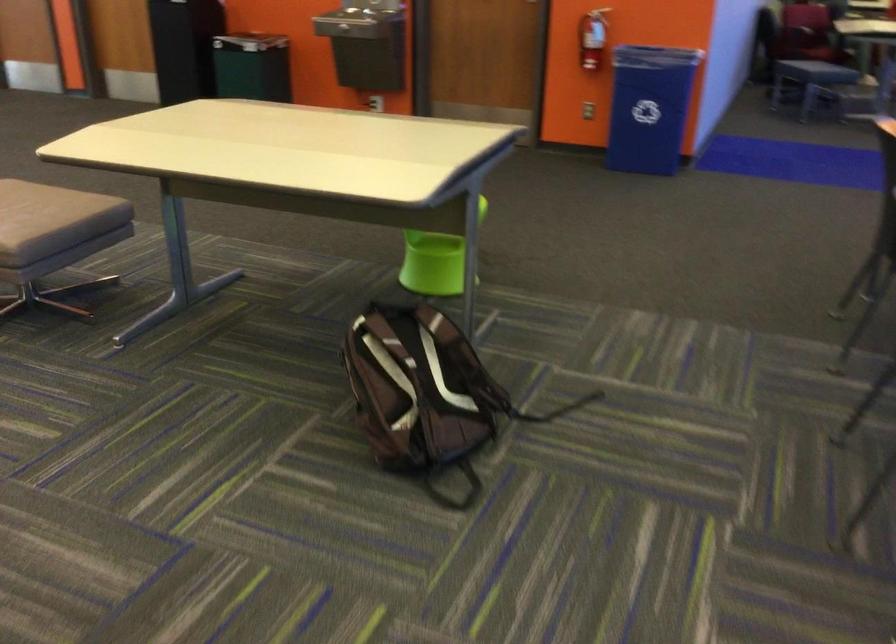
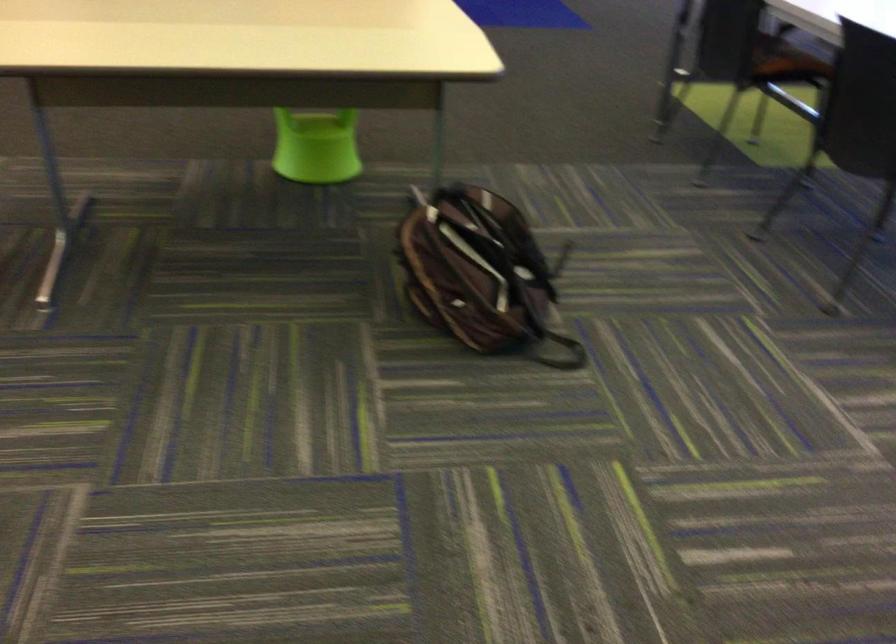
Find the pixel in the second image that matches point 393,389 in the first image.

(479, 272)